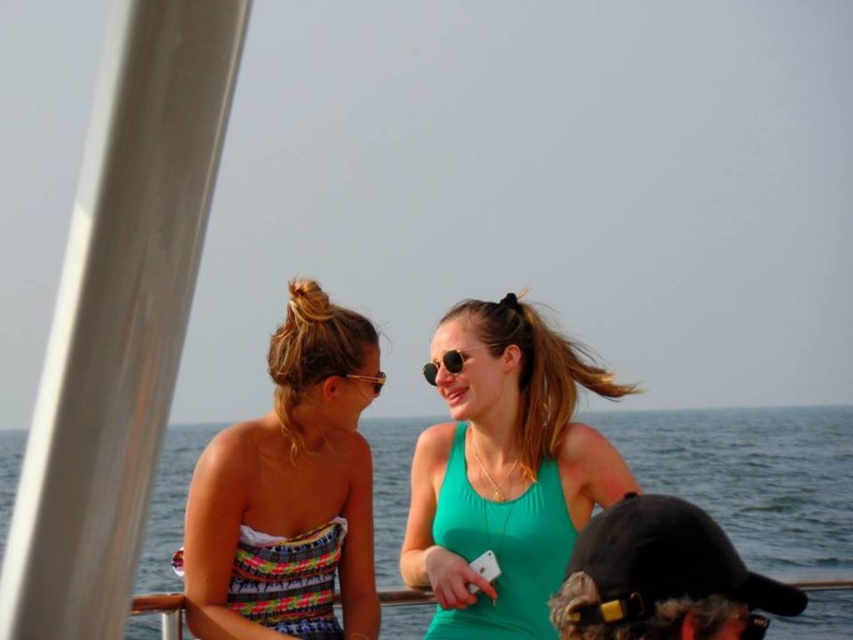
You are standing on the boat and want to pick up the black matte baseball cap at lower right. Which direction should you move to reach it?

The black matte baseball cap at lower right is located at point 0.900 on the x and 0.774 on the y, so you should move towards the lower right direction to reach it.

You are standing on the deck of a boat and want to take a photo of the point located at coordinate point (219, 476). Given that your camera has a focal length of 50mm and you are 13.24 meters away from the point, what is the required sensor size in millimeters to capture the entire point in the frame?

The point located at coordinate point (219, 476) is 13.24 meters from the camera. To calculate the required sensor size, use the formula sensor size equals focal length multiplied by distance divided by subject size. However, since the point is a single coordinate with no specified dimensions, it cannot be captured as an image requires a two dimensional subject. Therefore, the question is invalid as a point has no size.

You are standing at the center of the boat and want to hand a seashell to the person wearing the multicolored strapless dress at left. Which direction should you walk to reach them?

You should walk to the left to reach the multicolored strapless dress at left since they are positioned at the left side of the boat.